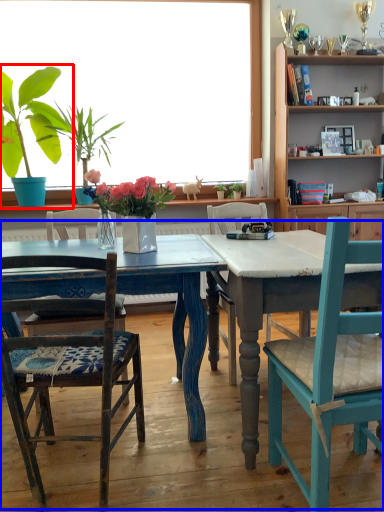
Question: Which object is further to the camera taking this photo, houseplant (highlighted by a red box) or kitchen & dining room table (highlighted by a blue box)?

Choices:
 (A) houseplant
 (B) kitchen & dining room table

Answer: (A)